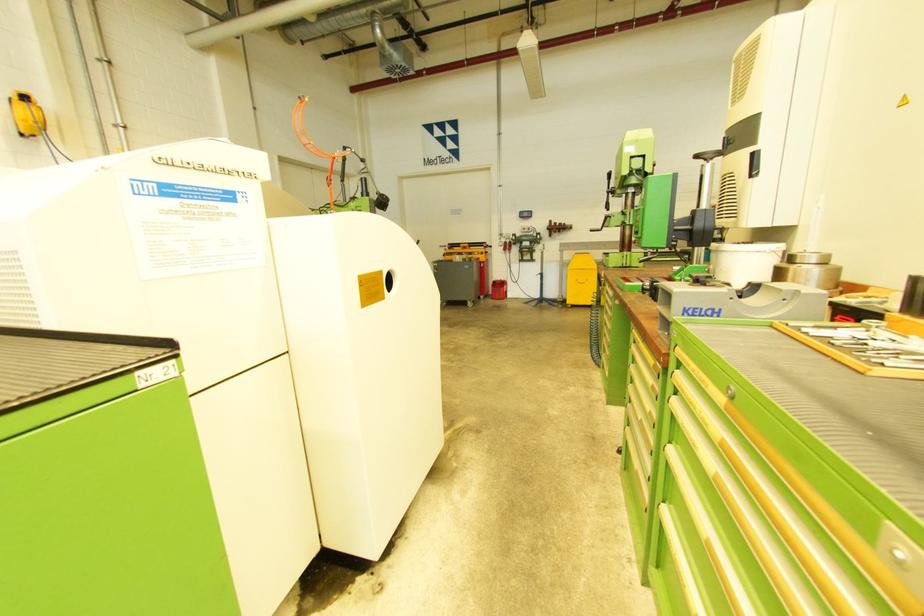
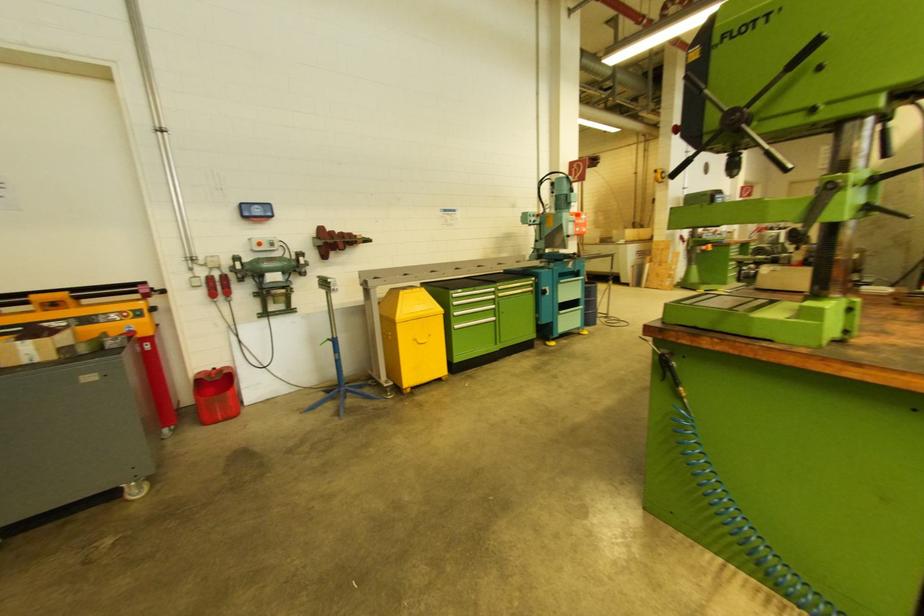
Find the pixel in the second image that matches the point at 553,224 in the first image.

(323, 231)